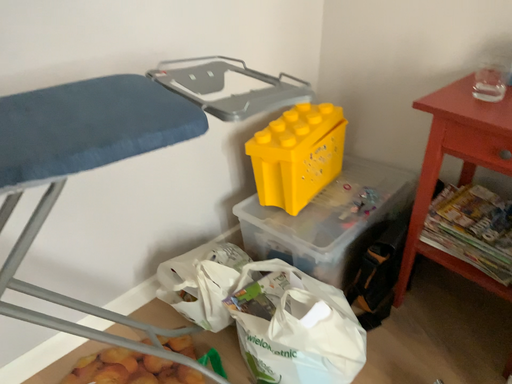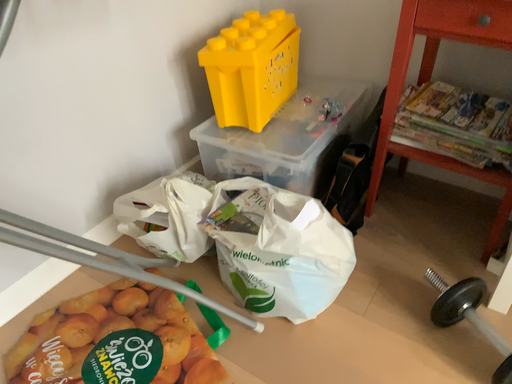
Question: How did the camera likely rotate when shooting the video?

Choices:
 (A) rotated left
 (B) rotated right

Answer: (B)